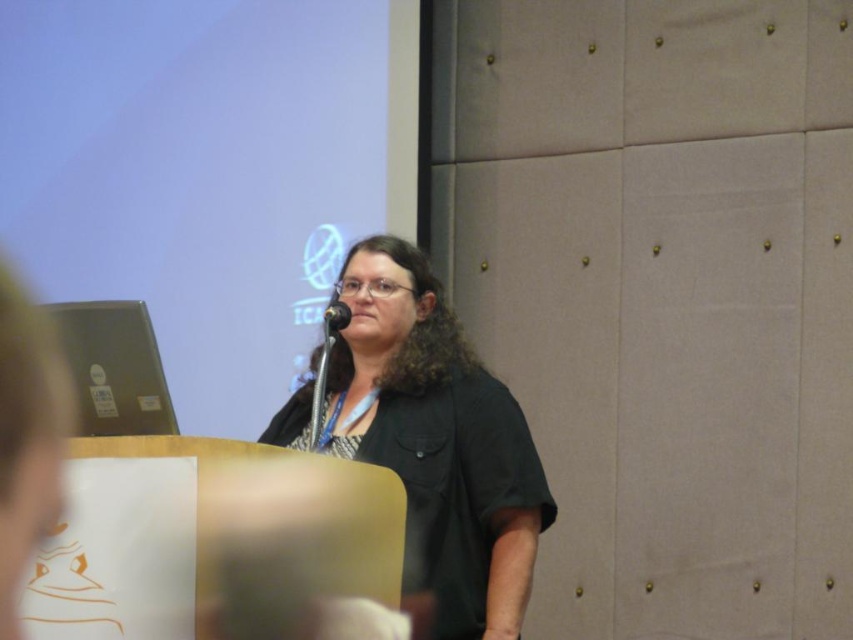
Question: Does satin silver laptop at left come in front of black metallic microphone at center?

Choices:
 (A) yes
 (B) no

Answer: (A)

Question: Which point is closer to the camera taking this photo?

Choices:
 (A) (426, 346)
 (B) (323, 310)
 (C) (78, 307)

Answer: (C)

Question: Estimate the real-world distances between objects in this image. Which object is closer to the black metallic microphone at center?

Choices:
 (A) black matte shirt at center
 (B) satin silver laptop at left

Answer: (A)

Question: Can you confirm if satin silver laptop at left is bigger than black metallic microphone at center?

Choices:
 (A) no
 (B) yes

Answer: (B)

Question: Among these objects, which one is farthest from the camera?

Choices:
 (A) satin silver laptop at left
 (B) black metallic microphone at center

Answer: (B)

Question: Is satin silver laptop at left positioned at the back of black metallic microphone at center?

Choices:
 (A) no
 (B) yes

Answer: (A)